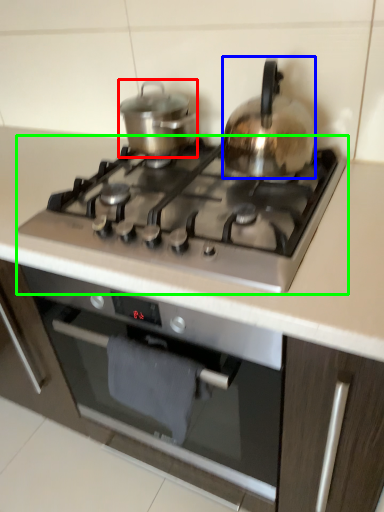
Question: Which is farther away from kitchen appliance (highlighted by a red box)? kitchen appliance (highlighted by a blue box) or gas stove (highlighted by a green box)?

Choices:
 (A) kitchen appliance
 (B) gas stove

Answer: (B)